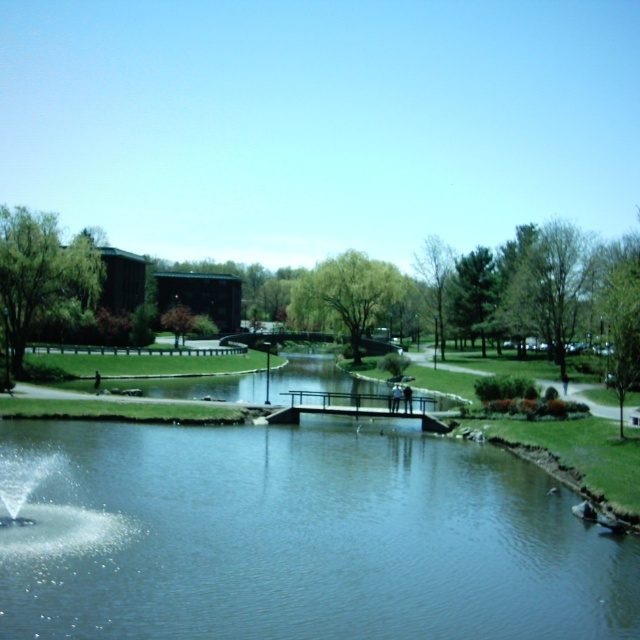
Looking at this image, you are standing at the point labeled as point (294, 538) in the park. What is located at that exact position?

The point (294, 538) indicates clear water at center.

Consider the image. You are standing at the fountain on the left side of the park and want to walk to the point marked at coordinates point (180, 484) and point (49, 476). Which point is closer to you?

Point (49, 476) is closer to you because it is less further away than point (180, 484).

You are planning to place a small decorative statue on the clear water at center and the clear water fountain at lower left. Which location would be more suitable for the statue in terms of space availability?

The clear water at center is bigger than the clear water fountain at lower left, so the statue would fit better on the clear water at center.